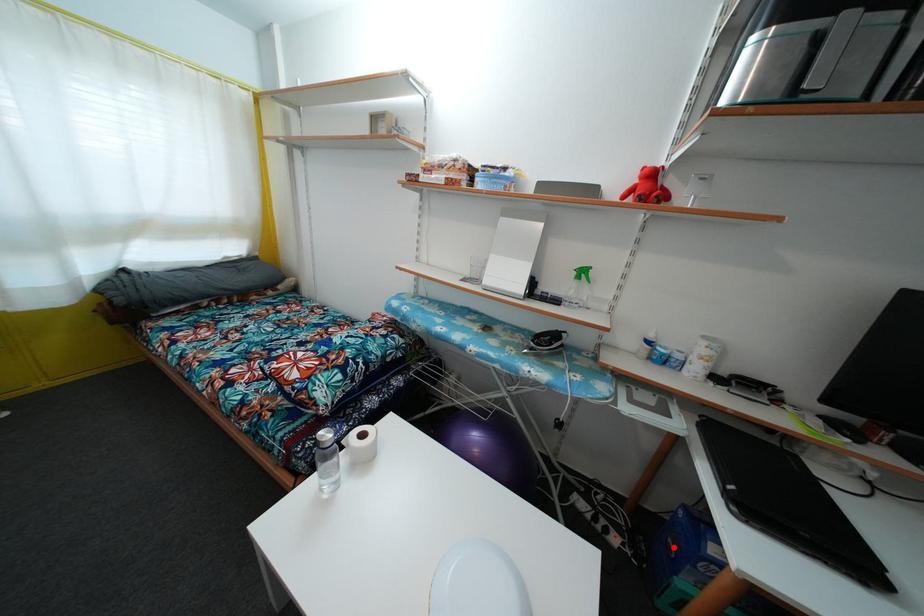
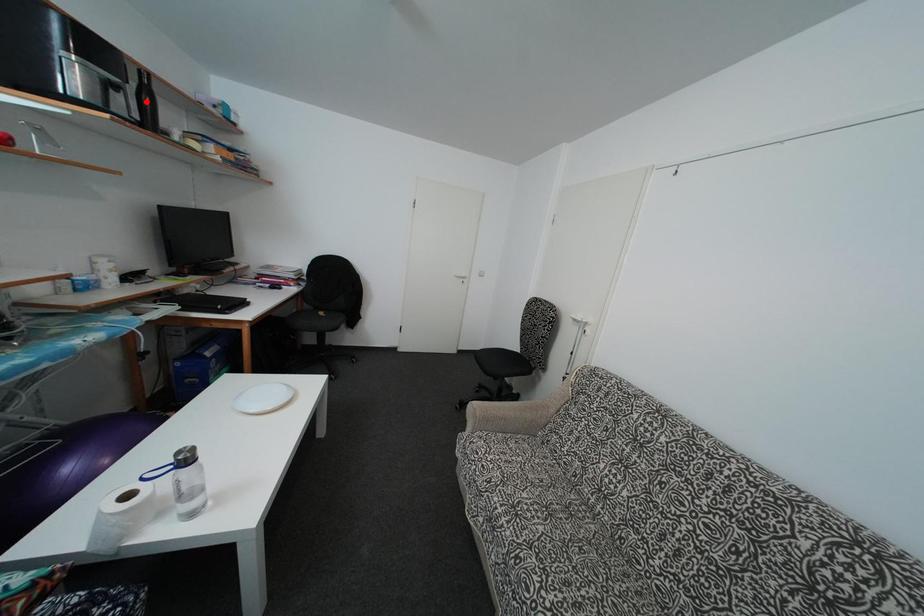
I am providing you with two images of the same scene from different viewpoints. A red point is marked on the first image and another point is marked on the second image. Do the highlighted points in image1 and image2 indicate the same real-world spot?

No